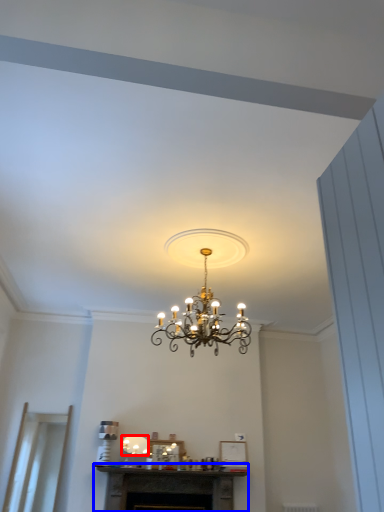
Question: Which object appears farthest to the camera in this image, lamp (highlighted by a red box) or fireplace (highlighted by a blue box)?

Choices:
 (A) lamp
 (B) fireplace

Answer: (A)